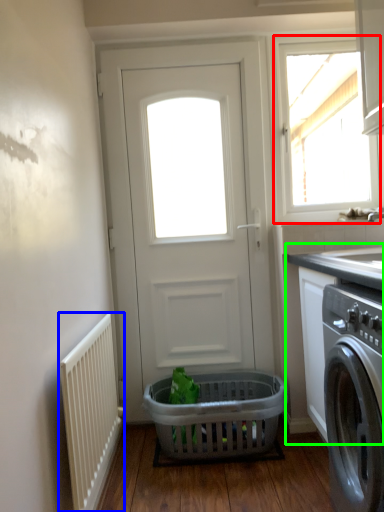
Question: Which object is the farthest from window (highlighted by a red box)? Choose among these: radiator (highlighted by a blue box) or counter top (highlighted by a green box).

Choices:
 (A) radiator
 (B) counter top

Answer: (A)